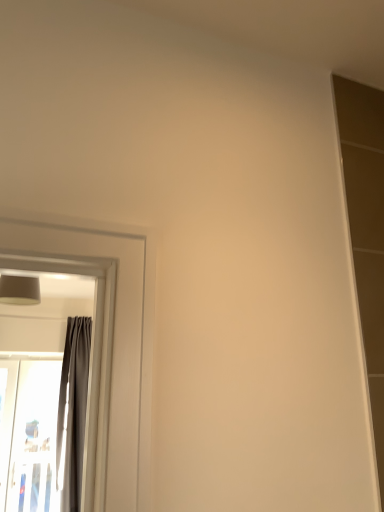
The width and height of the screenshot is (384, 512). What do you see at coordinates (28, 435) in the screenshot?
I see `transparent plastic screen door at left` at bounding box center [28, 435].

Locate an element on the screen. Image resolution: width=384 pixels, height=512 pixels. transparent plastic screen door at left is located at coordinates (28, 435).

In the image, is gray fabric curtain at left positioned in front of or behind matte gray lampshade at upper left?

gray fabric curtain at left is behind matte gray lampshade at upper left.

From the image's perspective, is gray fabric curtain at left on matte gray lampshade at upper left?

No.

The height and width of the screenshot is (512, 384). Find the location of `curtain below the matte gray lampshade at upper left (from the image's perspective)`. curtain below the matte gray lampshade at upper left (from the image's perspective) is located at coordinates (73, 412).

Is gray fabric curtain at left turned away from matte gray lampshade at upper left?

No, gray fabric curtain at left is not facing the opposite direction of matte gray lampshade at upper left.

Is the surface of gray fabric curtain at left in direct contact with transparent plastic screen door at left?

No, gray fabric curtain at left is not touching transparent plastic screen door at left.

Considering the relative sizes of gray fabric curtain at left and transparent plastic screen door at left in the image provided, is gray fabric curtain at left smaller than transparent plastic screen door at left?

No.

Looking at their sizes, would you say gray fabric curtain at left is wider or thinner than transparent plastic screen door at left?

gray fabric curtain at left is wider than transparent plastic screen door at left.

Is matte gray lampshade at upper left completely or partially inside transparent plastic screen door at left?

That's incorrect, matte gray lampshade at upper left is not inside transparent plastic screen door at left.

Who is taller, transparent plastic screen door at left or matte gray lampshade at upper left?

transparent plastic screen door at left.

Is transparent plastic screen door at left at the left side of matte gray lampshade at upper left?

Indeed, transparent plastic screen door at left is positioned on the left side of matte gray lampshade at upper left.

From a real-world perspective, which is physically below, transparent plastic screen door at left or matte gray lampshade at upper left?

In real-world perspective, transparent plastic screen door at left is lower.

Which object is wider, matte gray lampshade at upper left or gray fabric curtain at left?

With larger width is matte gray lampshade at upper left.

From the picture: Can you confirm if matte gray lampshade at upper left is positioned to the right of gray fabric curtain at left?

Yes, matte gray lampshade at upper left is to the right of gray fabric curtain at left.

Considering the relative sizes of matte gray lampshade at upper left and gray fabric curtain at left in the image provided, is matte gray lampshade at upper left bigger than gray fabric curtain at left?

No.

Is matte gray lampshade at upper left surrounding gray fabric curtain at left?

No, gray fabric curtain at left is not inside matte gray lampshade at upper left.

Based on the photo, from a real-world perspective, who is located higher, transparent plastic screen door at left or gray fabric curtain at left?

In real-world perspective, gray fabric curtain at left is above.

Measure the distance between transparent plastic screen door at left and gray fabric curtain at left.

14.14 inches.

Based on the photo, from the image's perspective, does transparent plastic screen door at left appear higher than gray fabric curtain at left?

Incorrect, from the image's perspective, transparent plastic screen door at left is lower than gray fabric curtain at left.

The height and width of the screenshot is (512, 384). In order to click on curtain above the transparent plastic screen door at left (from a real-world perspective) in this screenshot , I will do `click(73, 412)`.

Could you tell me if matte gray lampshade at upper left is turned towards transparent plastic screen door at left?

No, matte gray lampshade at upper left is not turned towards transparent plastic screen door at left.

This screenshot has height=512, width=384. I want to click on screen door on the left side of matte gray lampshade at upper left, so click(28, 435).

Would you say matte gray lampshade at upper left is a long distance from transparent plastic screen door at left?

Yes, matte gray lampshade at upper left and transparent plastic screen door at left are quite far apart.

Which point is more forward, (21,286) or (11,445)?

Positioned in front is point (21,286).

You are a GUI agent. You are given a task and a screenshot of the screen. Output one action in this format:
    pyautogui.click(x=<x>, y=<y>)
    Task: Click on the lamp located in front of the gray fabric curtain at left
    
    Given the screenshot: What is the action you would take?
    pyautogui.click(x=19, y=290)

Identify the location of screen door that is under the gray fabric curtain at left (from a real-world perspective). The width and height of the screenshot is (384, 512). (28, 435).

In the scene shown: Based on their spatial positions, is gray fabric curtain at left or matte gray lampshade at upper left closer to transparent plastic screen door at left?

gray fabric curtain at left is closer to transparent plastic screen door at left.

Based on the photo, from the image, which object appears to be nearer to matte gray lampshade at upper left, transparent plastic screen door at left or gray fabric curtain at left?

The object closer to matte gray lampshade at upper left is gray fabric curtain at left.

When comparing their distances from matte gray lampshade at upper left, does gray fabric curtain at left or transparent plastic screen door at left seem further?

transparent plastic screen door at left lies further to matte gray lampshade at upper left than the other object.

Looking at the image, which one is located further to transparent plastic screen door at left, matte gray lampshade at upper left or gray fabric curtain at left?

Based on the image, matte gray lampshade at upper left appears to be further to transparent plastic screen door at left.

Estimate the real-world distances between objects in this image. Which object is further from gray fabric curtain at left, matte gray lampshade at upper left or transparent plastic screen door at left?

matte gray lampshade at upper left.

Considering their positions, is transparent plastic screen door at left positioned further to gray fabric curtain at left than matte gray lampshade at upper left?

matte gray lampshade at upper left is positioned further to the anchor gray fabric curtain at left.

Identify the location of curtain between matte gray lampshade at upper left and transparent plastic screen door at left vertically. The image size is (384, 512). [x=73, y=412].